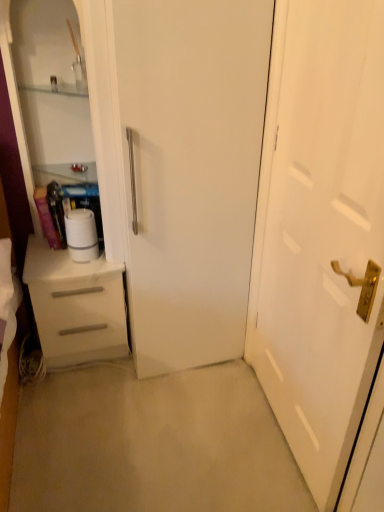
Question: Can you confirm if white matte paper towel at left is positioned to the right of white glossy dresser at left?

Choices:
 (A) no
 (B) yes

Answer: (B)

Question: Is white matte paper towel at left positioned behind white glossy dresser at left?

Choices:
 (A) no
 (B) yes

Answer: (B)

Question: Could you tell me if white matte paper towel at left is facing white glossy dresser at left?

Choices:
 (A) yes
 (B) no

Answer: (A)

Question: Can you confirm if white matte paper towel at left is wider than white glossy dresser at left?

Choices:
 (A) no
 (B) yes

Answer: (A)

Question: Can you confirm if white matte paper towel at left is thinner than white glossy dresser at left?

Choices:
 (A) yes
 (B) no

Answer: (A)

Question: Does point (327, 100) appear closer or farther from the camera than point (69, 282)?

Choices:
 (A) closer
 (B) farther

Answer: (A)

Question: In the image, is white glossy door at center on the left side or the right side of white matte drawer at left?

Choices:
 (A) right
 (B) left

Answer: (A)

Question: Looking at their shapes, would you say white glossy door at center is wider or thinner than white matte drawer at left?

Choices:
 (A) thin
 (B) wide

Answer: (A)

Question: Based on their sizes in the image, would you say white glossy door at center is bigger or smaller than white matte drawer at left?

Choices:
 (A) big
 (B) small

Answer: (B)

Question: Based on their positions, is white glossy dresser at left located to the left or right of white glossy door at center?

Choices:
 (A) right
 (B) left

Answer: (B)

Question: In terms of width, does white glossy dresser at left look wider or thinner when compared to white glossy door at center?

Choices:
 (A) thin
 (B) wide

Answer: (B)

Question: Considering the positions of point (94, 119) and point (248, 309), is point (94, 119) closer or farther from the camera than point (248, 309)?

Choices:
 (A) farther
 (B) closer

Answer: (B)

Question: In terms of size, does white glossy dresser at left appear bigger or smaller than white glossy door at center?

Choices:
 (A) small
 (B) big

Answer: (B)

Question: Is white matte paper towel at left inside the boundaries of white glossy door at center, or outside?

Choices:
 (A) inside
 (B) outside

Answer: (B)

Question: Considering the positions of white matte paper towel at left and white glossy door at center in the image, is white matte paper towel at left taller or shorter than white glossy door at center?

Choices:
 (A) tall
 (B) short

Answer: (B)